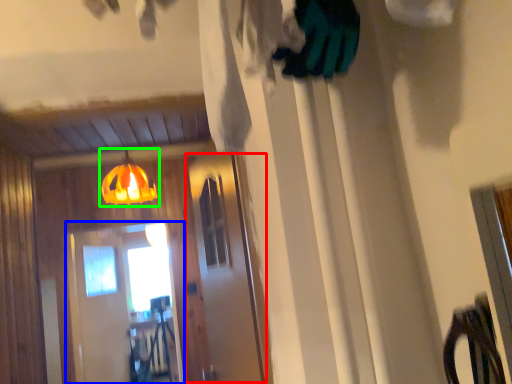
Question: Which is nearer to the screen door (highlighted by a red box)? screen door (highlighted by a blue box) or lamp (highlighted by a green box).

Choices:
 (A) screen door
 (B) lamp

Answer: (B)